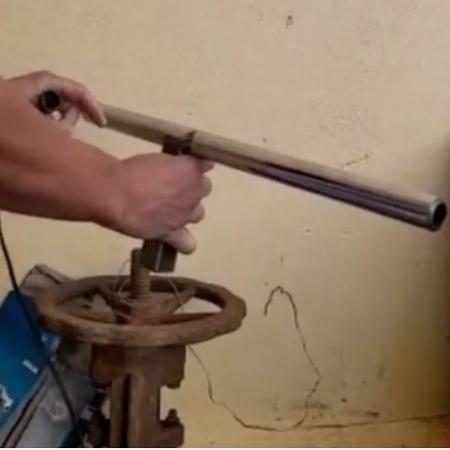
Find the location of a particular element. The width and height of the screenshot is (450, 450). crack in wall is located at coordinates pos(302,345).